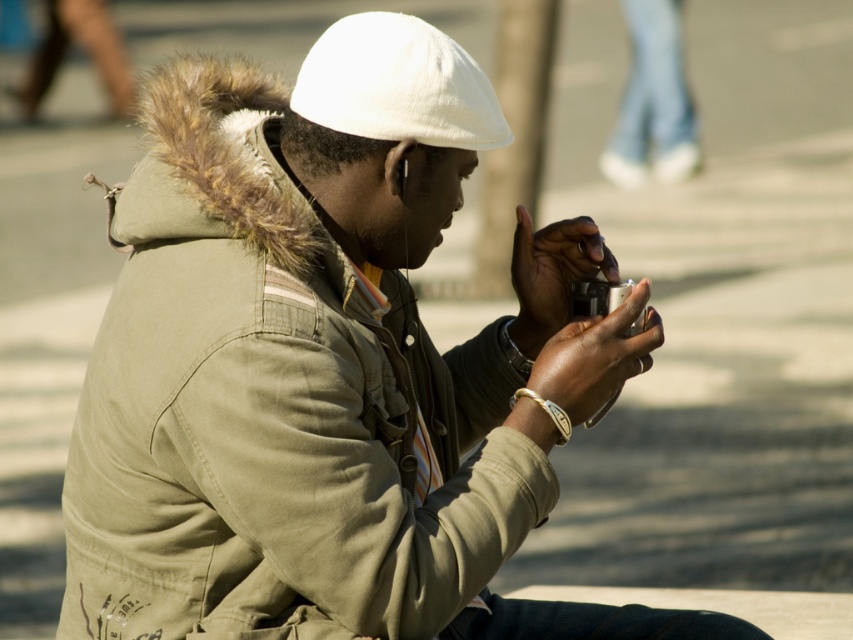
Does white fabric hat at upper center lie behind silver metallic camera at center?

No, it is not.

This screenshot has width=853, height=640. I want to click on white fabric hat at upper center, so click(x=397, y=84).

Find the location of a particular element. The width and height of the screenshot is (853, 640). white fabric hat at upper center is located at coordinates (397, 84).